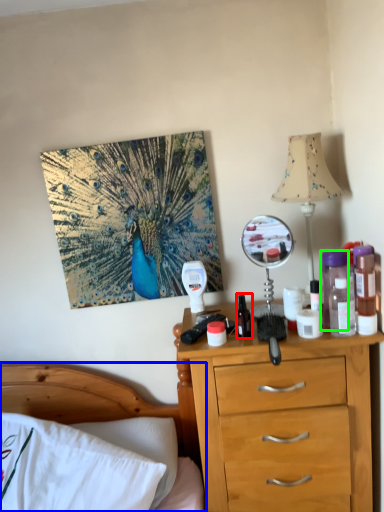
Question: Which object is the farthest from bottle (highlighted by a red box)? Choose among these: bed (highlighted by a blue box) or bottle (highlighted by a green box).

Choices:
 (A) bed
 (B) bottle

Answer: (A)